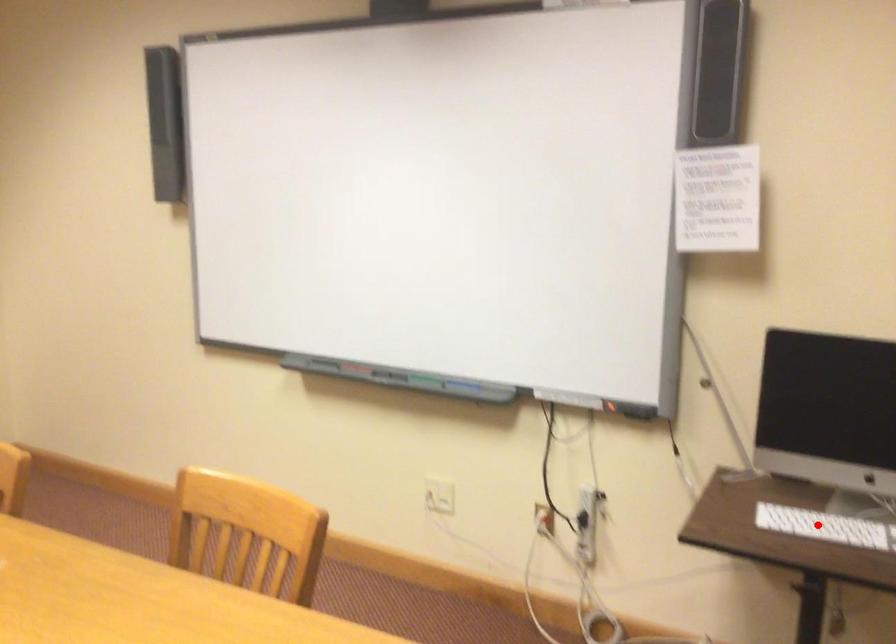
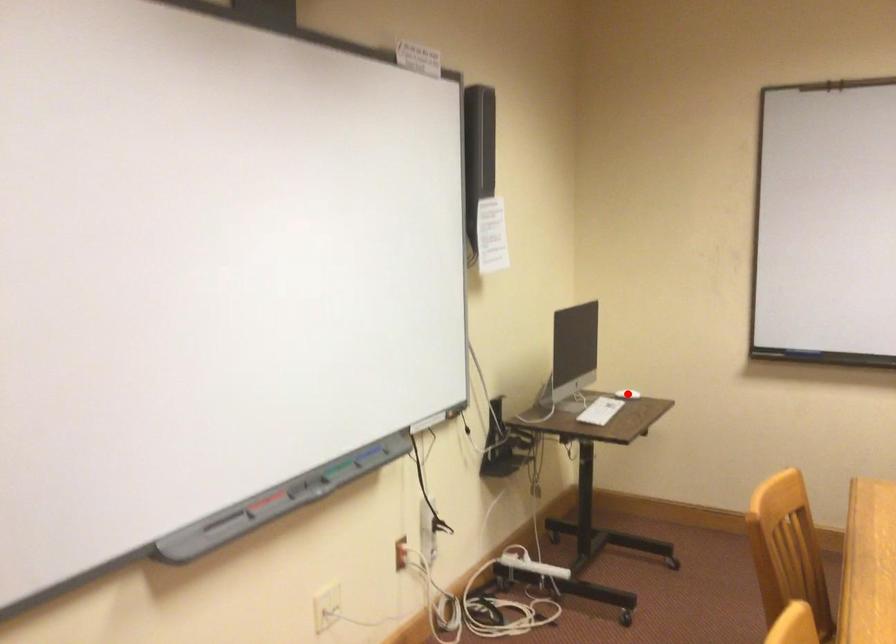
I am providing you with two images of the same scene from different viewpoints. A red point is marked on the first image and another point is marked on the second image. Do the highlighted points in image1 and image2 indicate the same real-world spot?

No